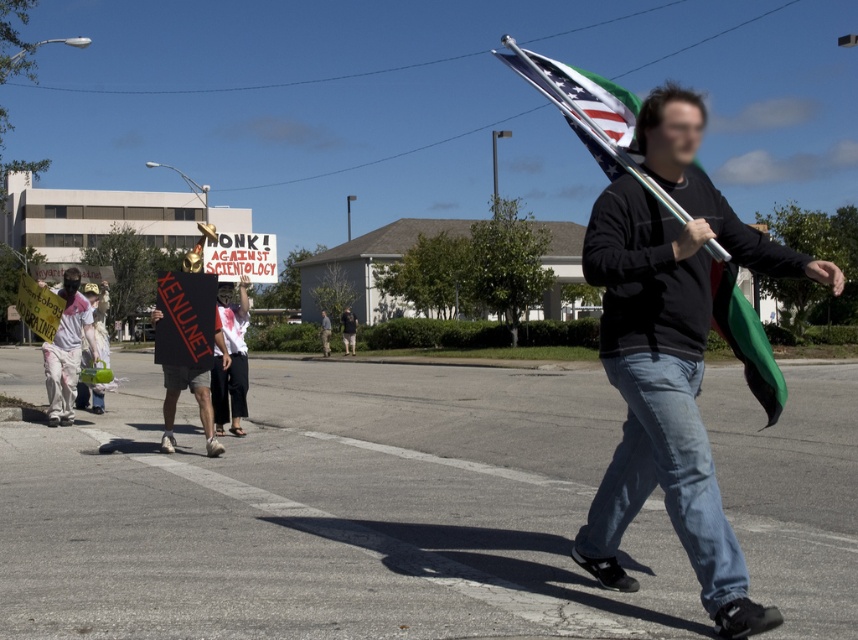
In the scene shown: You are a photographer standing at the scene. You want to take a photo that includes both the matte black shirt at center and the american flag at center. How far apart are these two objects in feet?

The distance between the matte black shirt at center and the american flag at center is 6.66 feet.

You are a photographer standing in the street and want to take a photo of the white paper sign at center and the american flag at center. Which object will appear larger in your photo?

The american flag at center will appear larger in the photo because it is closer to the viewer than the white paper sign at center.

You are a photographer trying to capture a clear shot of both the matte black shirt at center and the white paper sign at center. Based on their sizes in the image, which one should you focus on first to ensure it fits in the frame?

The matte black shirt at center is taller than the white paper sign at center, so you should focus on the matte black shirt at center first to ensure it fits in the frame since it is larger.